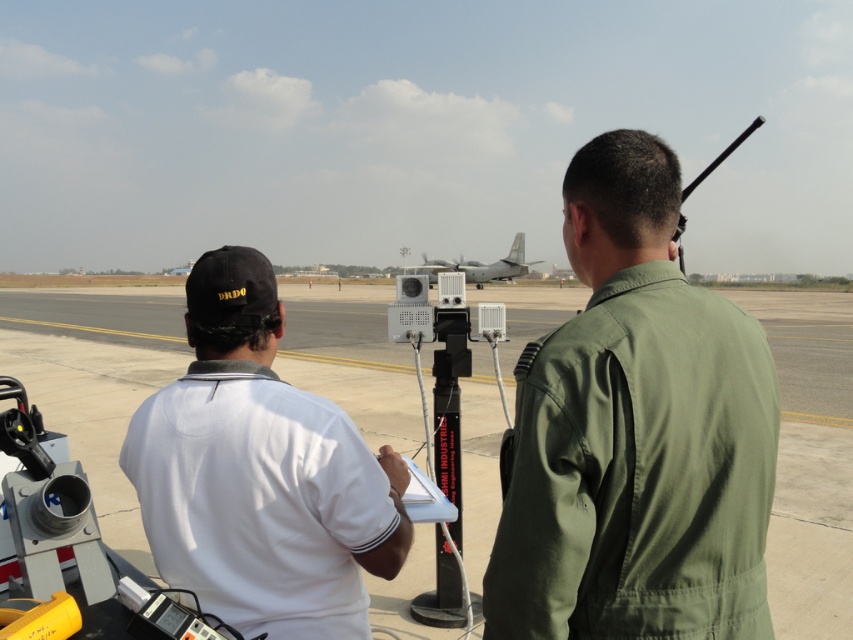
You are a technician who needs to place a heavy equipment box on the smooth concrete tarmac at center. However, there is a gray matte airplane at center in the way. Can you place the box directly under the airplane?

The smooth concrete tarmac at center is positioned under the gray matte airplane at center, so placing the box directly under the airplane would mean placing it on the smooth concrete tarmac at center. However, since the airplane is already above the tarmac at that location, the box cannot be placed there as it would be underneath the airplane.

You are a photographer positioned at the back of the airfield. You need to capture a photo of the smooth concrete tarmac at center and the white matte shirt at left. Which object should you zoom in on to ensure both are in focus without moving the camera?

The smooth concrete tarmac at center is wider than the white matte shirt at left, so zooming in on the wider object, the smooth concrete tarmac at center, will ensure both are in focus.

You are a photographer positioned behind the two individuals on the airfield. You want to capture a photo where the smooth concrete tarmac at center is visible above the white matte shirt at left. Is this possible based on their current positions?

Yes, because the smooth concrete tarmac at center is already positioned above the white matte shirt at left in their current arrangement.